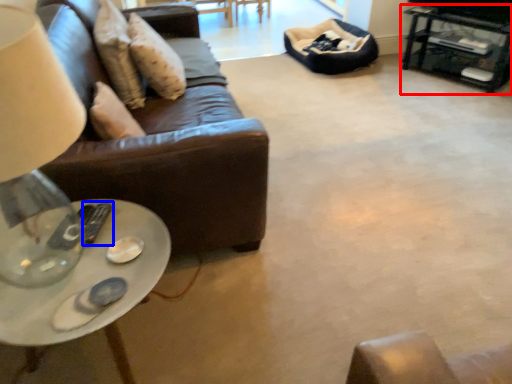
Question: Which object appears closest to the camera in this image, table (highlighted by a red box) or remote (highlighted by a blue box)?

Choices:
 (A) table
 (B) remote

Answer: (B)